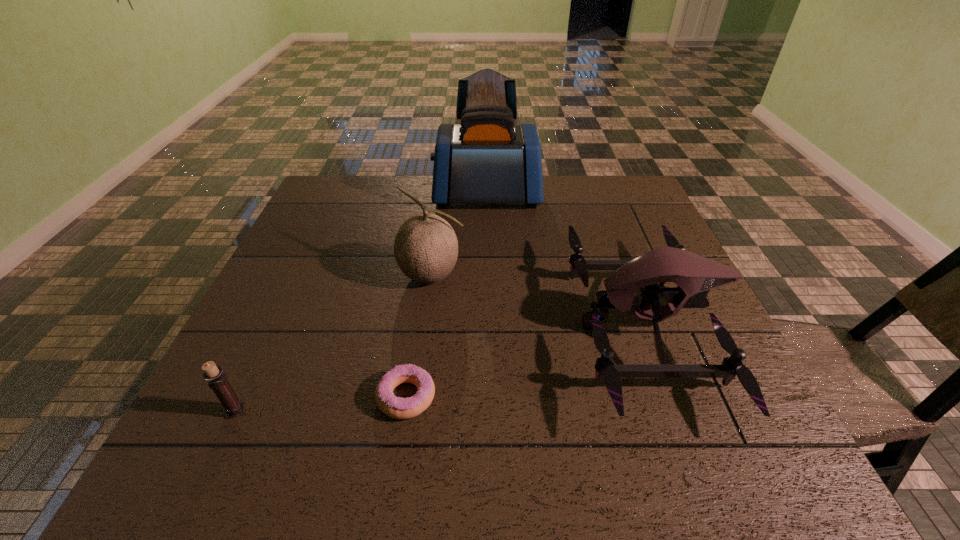
Find the location of a particular element. The image size is (960, 540). toaster is located at coordinates (487, 159).

At what (x,y) coordinates should I click in order to perform the action: click on the tallest object. Please return your answer as a coordinate pair (x, y). The width and height of the screenshot is (960, 540). Looking at the image, I should click on (487, 159).

The image size is (960, 540). Find the location of `cantaloup`. cantaloup is located at coordinates (425, 247).

Where is `the rightmost object`? Image resolution: width=960 pixels, height=540 pixels. the rightmost object is located at coordinates (695, 275).

Identify the location of the leftmost object. (217, 381).

This screenshot has height=540, width=960. Find the location of `the second shortest object`. the second shortest object is located at coordinates (217, 381).

Locate an element on the screen. Image resolution: width=960 pixels, height=540 pixels. doughnut is located at coordinates (396, 407).

The height and width of the screenshot is (540, 960). I want to click on vacant space located on the front-facing side of the tallest object, so click(405, 197).

The image size is (960, 540). I want to click on vacant space situated 0.330m on the front-facing side of the tallest object, so click(x=330, y=197).

You are a GUI agent. You are given a task and a screenshot of the screen. Output one action in this format:
    pyautogui.click(x=<x>, y=<y>)
    Task: Click on the free space located on the front-facing side of the tallest object
    The width and height of the screenshot is (960, 540).
    Given the screenshot: What is the action you would take?
    pyautogui.click(x=336, y=197)